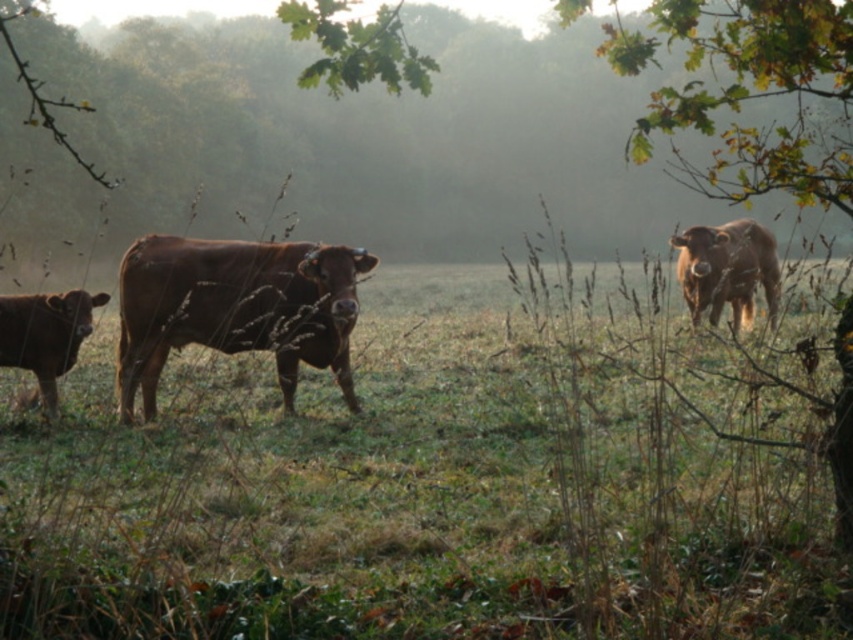
You are a photographer standing in the field and want to take a photo of the shiny brown bull at lower left. However, there is a brown matte cow at right blocking your view. Can you adjust your position to capture the bull without the cow obstructing the shot?

The shiny brown bull at lower left is behind the brown matte cow at right, so moving your position to the side or behind the cow might allow you to capture the bull without obstruction.